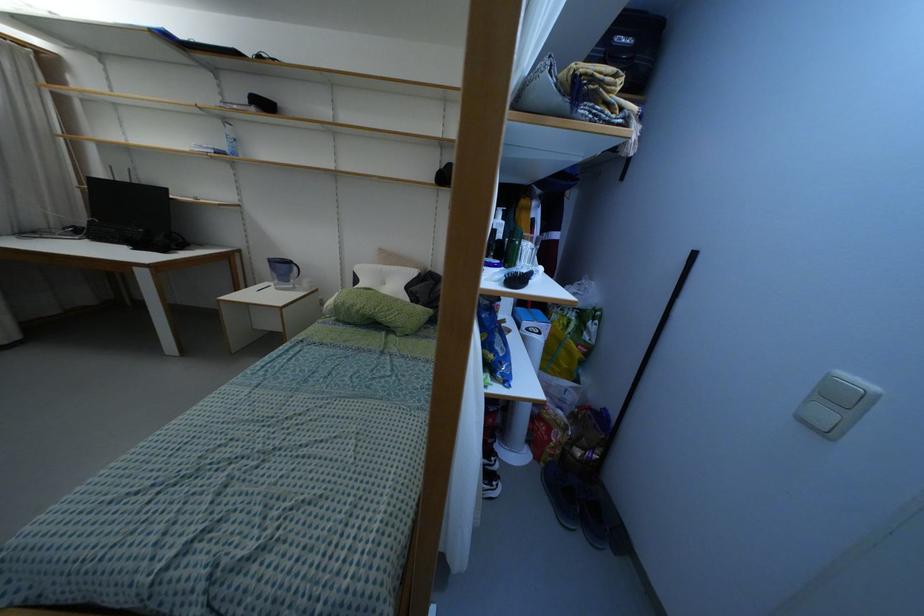
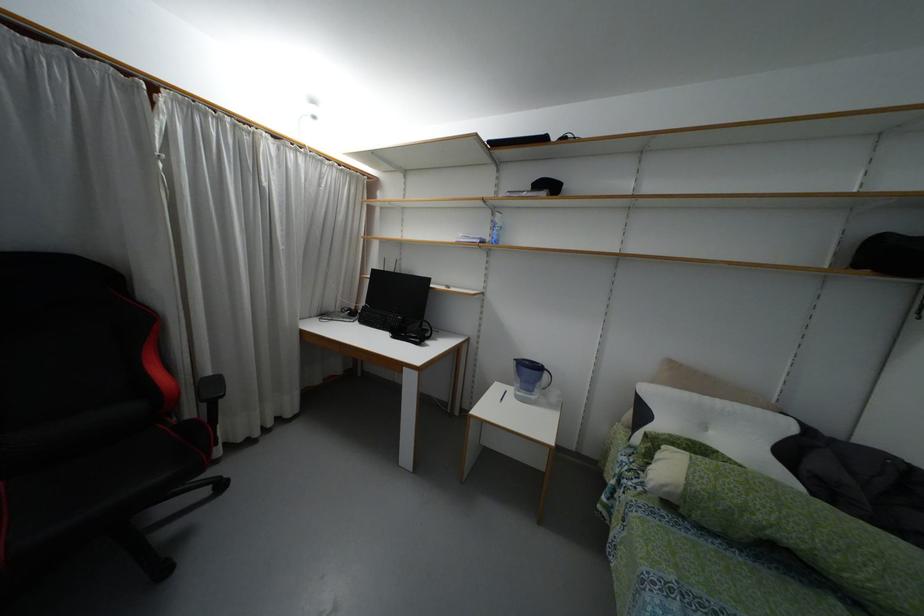
Find the pixel in the second image that matches (x=295, y=268) in the first image.

(544, 375)